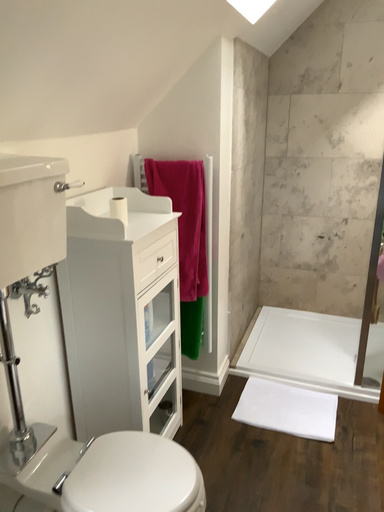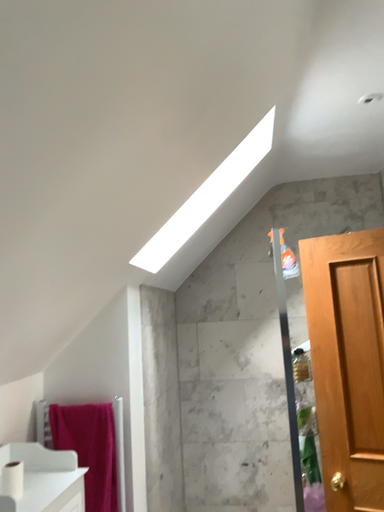
Question: How did the camera likely rotate when shooting the video?

Choices:
 (A) rotated upward
 (B) rotated downward

Answer: (A)